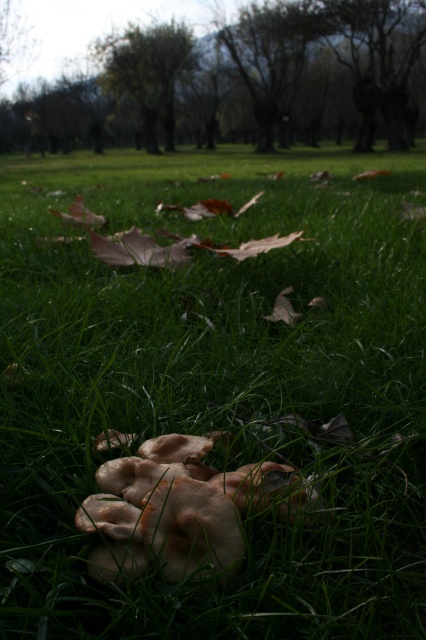
Question: Among these objects, which one is farthest from the camera?

Choices:
 (A) brown textured tree at center
 (B) green leafy tree at upper center

Answer: (B)

Question: Which object is the farthest from the green leafy tree at upper center?

Choices:
 (A) brown textured tree at center
 (B) light brown soft fungi at center

Answer: (B)

Question: Which point is farther to the camera?

Choices:
 (A) light brown soft fungi at center
 (B) green leafy tree at upper center
 (C) brown textured tree at center

Answer: (B)

Question: Can you confirm if brown textured tree at center is wider than light brown soft fungi at center?

Choices:
 (A) no
 (B) yes

Answer: (B)

Question: Is brown textured tree at center bigger than light brown soft fungi at center?

Choices:
 (A) no
 (B) yes

Answer: (B)

Question: Considering the relative positions of brown textured tree at center and light brown soft fungi at center in the image provided, where is brown textured tree at center located with respect to light brown soft fungi at center?

Choices:
 (A) right
 (B) left

Answer: (A)